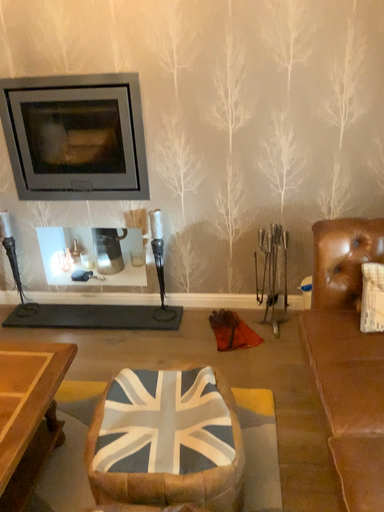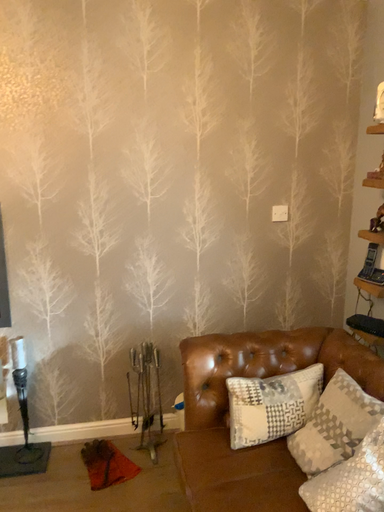
Question: Which way did the camera rotate in the video?

Choices:
 (A) rotated right
 (B) rotated left

Answer: (A)